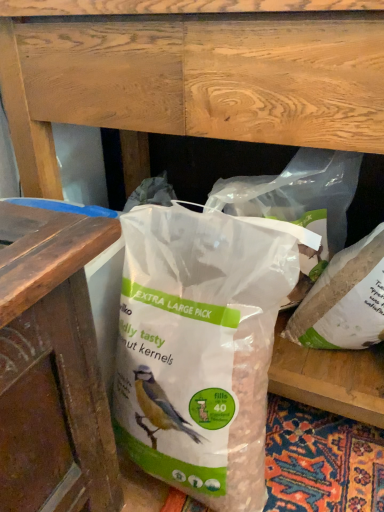
Question: Considering the positions of point (345, 233) and point (201, 224), is point (345, 233) closer or farther from the camera than point (201, 224)?

Choices:
 (A) closer
 (B) farther

Answer: (B)

Question: Would you say translucent plastic bag at center, the 2th plastic bag positioned from the right, is inside or outside translucent plastic bag at center, the first plastic bag positioned from the left?

Choices:
 (A) outside
 (B) inside

Answer: (A)

Question: Estimate the real-world distances between objects in this image. Which object is farther from the translucent plastic bag at center, the 2th plastic bag positioned from the right?

Choices:
 (A) translucent plastic bag at center, the first plastic bag positioned from the left
 (B) white matte plastic bag at center, arranged as the 1th plastic bag when viewed from the right

Answer: (A)

Question: Which of these objects is positioned closest to the white matte plastic bag at center, the third plastic bag in the left-to-right sequence?

Choices:
 (A) translucent plastic bag at center, the first plastic bag positioned from the left
 (B) translucent plastic bag at center, the 2th plastic bag positioned from the right

Answer: (B)